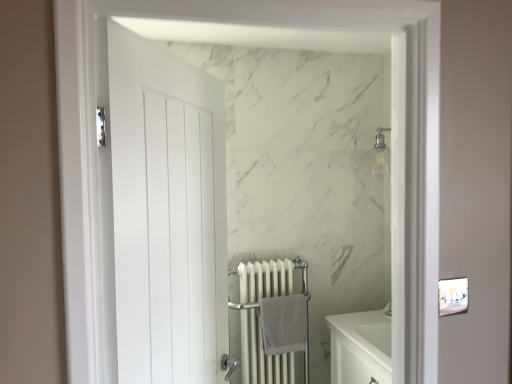
Question: Should I look upward or downward to see white metal radiator at center?

Choices:
 (A) down
 (B) up

Answer: (A)

Question: Is gray cotton bath towel at center far from white matte door at left?

Choices:
 (A) no
 (B) yes

Answer: (B)

Question: Does gray cotton bath towel at center turn towards white matte door at left?

Choices:
 (A) no
 (B) yes

Answer: (A)

Question: Is gray cotton bath towel at center not within white matte door at left?

Choices:
 (A) no
 (B) yes

Answer: (B)

Question: Considering the relative positions of gray cotton bath towel at center and white matte door at left in the image provided, is gray cotton bath towel at center to the right of white matte door at left from the viewer's perspective?

Choices:
 (A) yes
 (B) no

Answer: (A)

Question: From a real-world perspective, does gray cotton bath towel at center sit lower than white matte door at left?

Choices:
 (A) no
 (B) yes

Answer: (B)

Question: Are gray cotton bath towel at center and white matte door at left beside each other?

Choices:
 (A) no
 (B) yes

Answer: (A)

Question: Does white metal radiator at center turn towards gray cotton bath towel at center?

Choices:
 (A) yes
 (B) no

Answer: (A)

Question: Is white metal radiator at center next to gray cotton bath towel at center?

Choices:
 (A) yes
 (B) no

Answer: (B)

Question: From a real-world perspective, is white metal radiator at center positioned under gray cotton bath towel at center based on gravity?

Choices:
 (A) yes
 (B) no

Answer: (A)

Question: Does white metal radiator at center have a greater height compared to gray cotton bath towel at center?

Choices:
 (A) no
 (B) yes

Answer: (B)

Question: Are white metal radiator at center and gray cotton bath towel at center located far from each other?

Choices:
 (A) yes
 (B) no

Answer: (B)

Question: From the image's perspective, does white metal radiator at center appear lower than gray cotton bath towel at center?

Choices:
 (A) no
 (B) yes

Answer: (B)

Question: Can you see white matte door at left touching gray cotton bath towel at center?

Choices:
 (A) yes
 (B) no

Answer: (B)